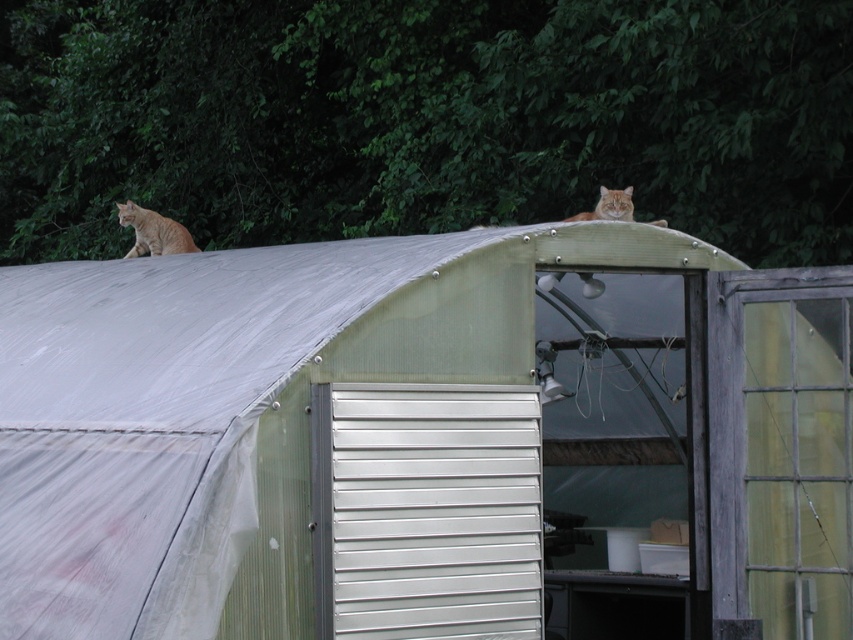
Question: Is metallic silver hut at center behind orange fur cat at upper center?

Choices:
 (A) no
 (B) yes

Answer: (A)

Question: Is orange fur cat at left positioned at the back of orange fur cat at upper center?

Choices:
 (A) yes
 (B) no

Answer: (A)

Question: Among these points, which one is farthest from the camera?

Choices:
 (A) (15, 515)
 (B) (171, 228)
 (C) (599, 205)

Answer: (B)

Question: Which point appears farthest from the camera in this image?

Choices:
 (A) (152, 252)
 (B) (444, 557)

Answer: (A)

Question: Which of the following is the closest to the observer?

Choices:
 (A) metallic silver hut at center
 (B) orange fur cat at upper center
 (C) orange fur cat at left

Answer: (A)

Question: Is metallic silver hut at center positioned behind orange fur cat at left?

Choices:
 (A) no
 (B) yes

Answer: (A)